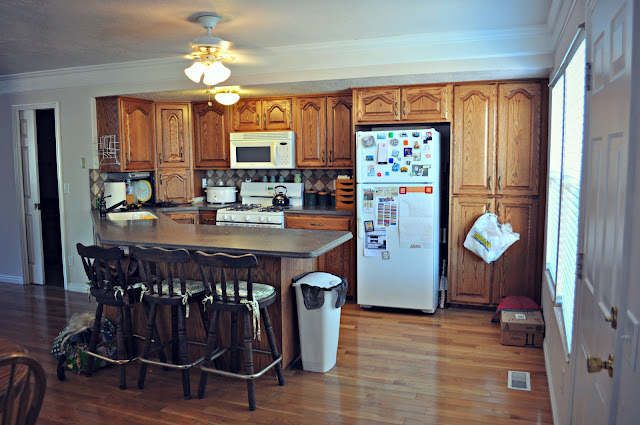
This screenshot has height=425, width=640. What are the coordinates of `chair` in the screenshot? It's located at (36, 363).